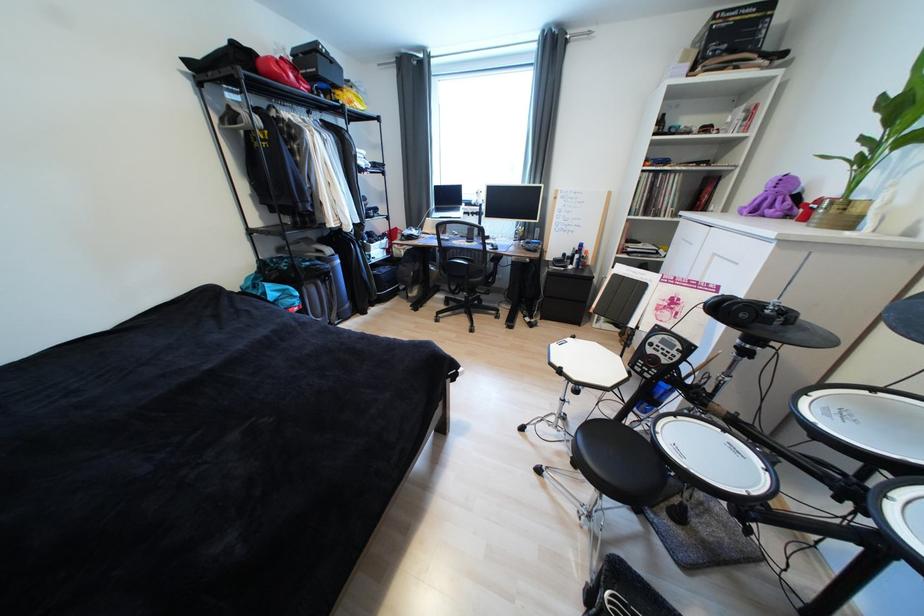
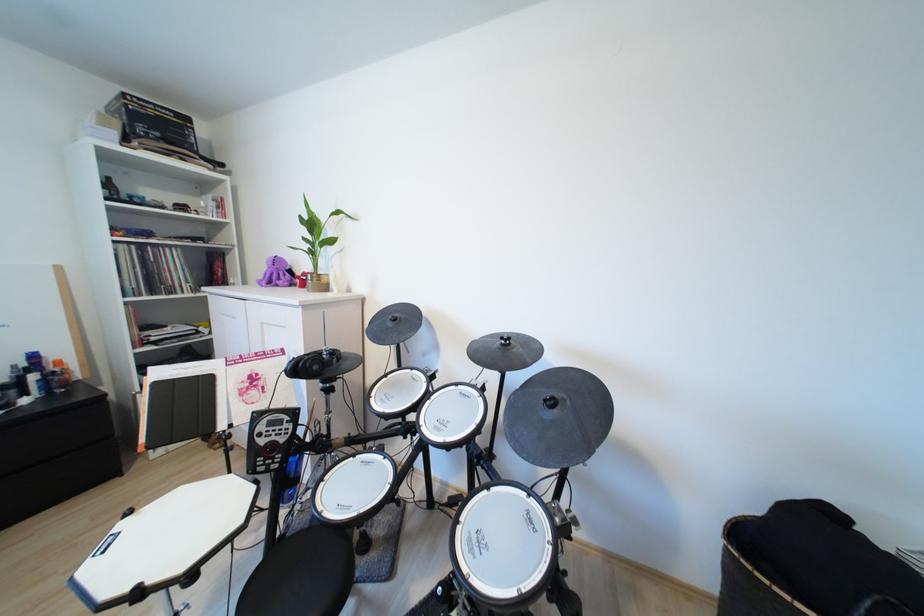
Find the pixel in the second image that matches (x=593, y=254) in the first image.

(66, 363)